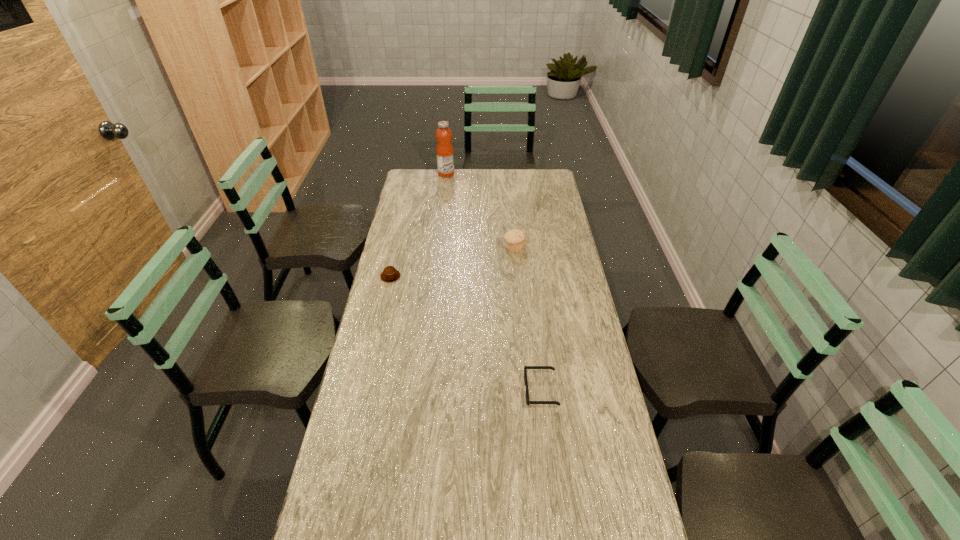
Locate an element on the screen. This screenshot has height=540, width=960. vacant region between the third shortest object and the farthest object is located at coordinates (480, 211).

Find the location of a particular element. This screenshot has width=960, height=540. free space between the third object from right to left and the nearer muffin is located at coordinates (419, 225).

Point out which object is positioned as the nearest to the fruit juice. Please provide its 2D coordinates. Your answer should be formatted as a tuple, i.e. [(x, y)], where the tuple contains the x and y coordinates of a point satisfying the conditions above.

[(515, 239)]

This screenshot has height=540, width=960. What are the coordinates of `object that ranks as the second closest to the fruit juice` in the screenshot? It's located at (390, 274).

In order to click on vacant region that satisfies the following two spatial constraints: 1. on the front label of the third object from right to left; 2. on the front side of the shorter muffin in this screenshot , I will do `click(435, 276)`.

This screenshot has width=960, height=540. Find the location of `vacant region that satisfies the following two spatial constraints: 1. on the front label of the tallest object; 2. on the front side of the leftmost object`. vacant region that satisfies the following two spatial constraints: 1. on the front label of the tallest object; 2. on the front side of the leftmost object is located at coordinates (435, 276).

You are a GUI agent. You are given a task and a screenshot of the screen. Output one action in this format:
    pyautogui.click(x=<x>, y=<y>)
    Task: Click on the free location that satisfies the following two spatial constraints: 1. on the front label of the second object from left to right; 2. on the front side of the left muffin
    This screenshot has height=540, width=960.
    Given the screenshot: What is the action you would take?
    pyautogui.click(x=435, y=276)

Locate an element on the screen. The width and height of the screenshot is (960, 540). vacant region that satisfies the following two spatial constraints: 1. on the front label of the second tallest object; 2. on the right side of the tallest object is located at coordinates pyautogui.click(x=438, y=248).

Find the location of a particular element. This screenshot has width=960, height=540. free location that satisfies the following two spatial constraints: 1. on the back side of the taller muffin; 2. on the left side of the shorter muffin is located at coordinates (396, 248).

The width and height of the screenshot is (960, 540). In order to click on vacant point that satisfies the following two spatial constraints: 1. on the front label of the tallest object; 2. on the front side of the leftmost object in this screenshot , I will do `click(435, 276)`.